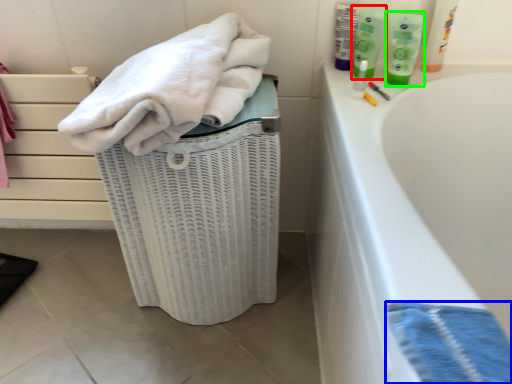
Question: Which is farther away from cleaning product (highlighted by a red box)? bath towel (highlighted by a blue box) or toiletry (highlighted by a green box)?

Choices:
 (A) bath towel
 (B) toiletry

Answer: (A)